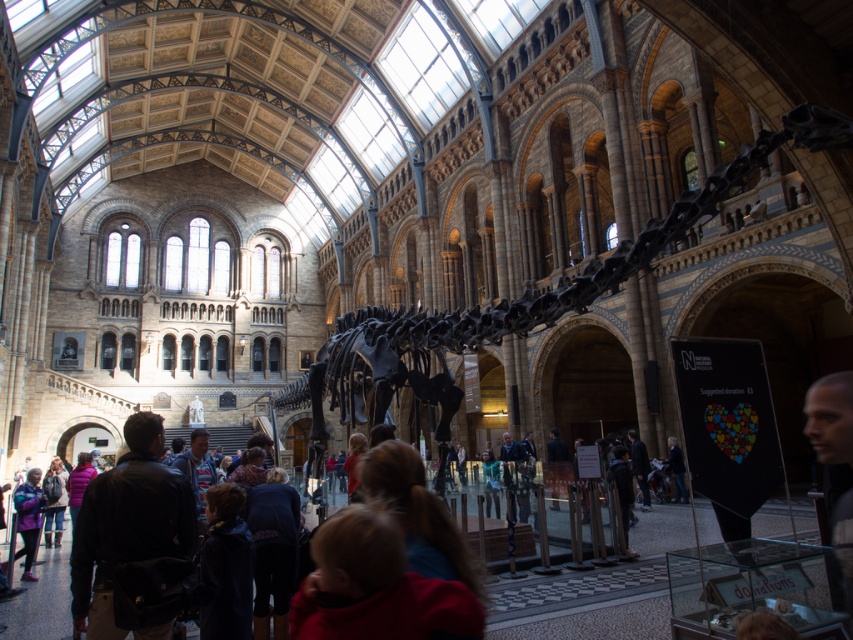
Question: Among these points, which one is farthest from the camera?

Choices:
 (A) (396, 612)
 (B) (15, 502)
 (C) (155, 531)

Answer: (B)

Question: Among these objects, which one is nearest to the camera?

Choices:
 (A) black leather jacket at center
 (B) matte purple jacket at lower left
 (C) black matte skeleton at center

Answer: (A)

Question: From the image, what is the correct spatial relationship of red fleece jacket at center in relation to black leather jacket at center?

Choices:
 (A) below
 (B) above

Answer: (A)

Question: Does black matte skeleton at center lie behind black leather jacket at center?

Choices:
 (A) no
 (B) yes

Answer: (B)

Question: Where is black matte skeleton at center located in relation to black leather jacket at center in the image?

Choices:
 (A) above
 (B) below

Answer: (A)

Question: Estimate the real-world distances between objects in this image. Which object is closer to the matte purple jacket at lower left?

Choices:
 (A) black leather jacket at center
 (B) red fleece jacket at center

Answer: (A)